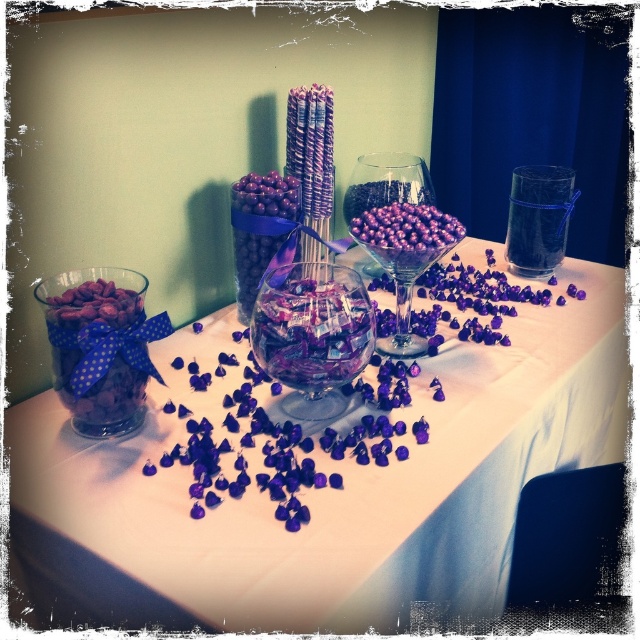
Question: Which of these objects is positioned closest to the transparent glass bowl at center?

Choices:
 (A) purple glossy chocolate at center
 (B) translucent glass vase at center

Answer: (A)

Question: Which point is farther to the camera?

Choices:
 (A) transparent glass bowl at center
 (B) translucent glass vase at center
 (C) matte purple candy at left

Answer: (A)

Question: Is matte purple candy at left to the left of transparent glass bowl at center from the viewer's perspective?

Choices:
 (A) no
 (B) yes

Answer: (B)

Question: Does translucent glass martini glass at center appear over purple glossy chocolate at center?

Choices:
 (A) yes
 (B) no

Answer: (B)

Question: Estimate the real-world distances between objects in this image. Which object is closer to the transparent glass bowl at center?

Choices:
 (A) translucent glass martini glass at center
 (B) matte purple candy at left
 (C) translucent glass vase at center

Answer: (A)

Question: Is matte purple candy at left bigger than transparent glass bowl at center?

Choices:
 (A) yes
 (B) no

Answer: (B)